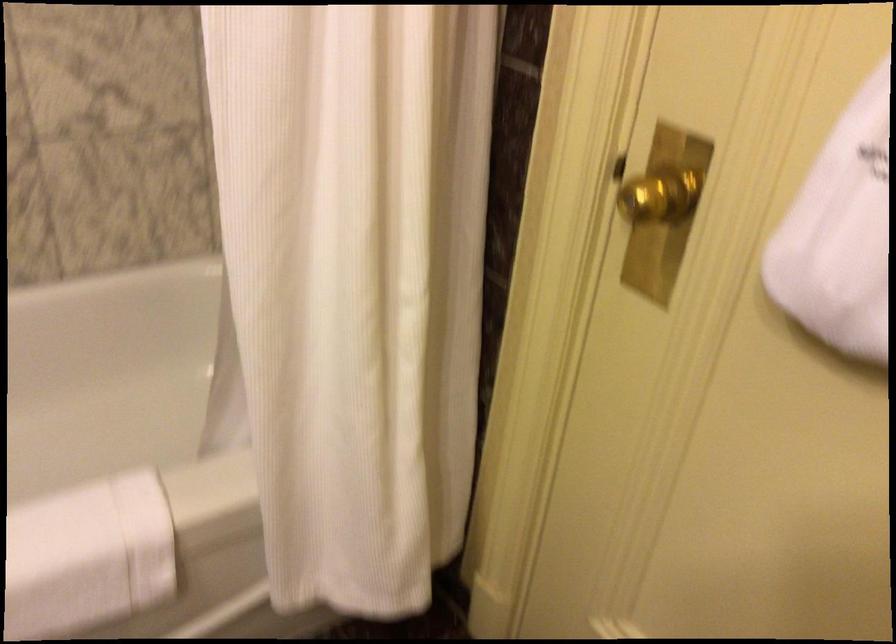
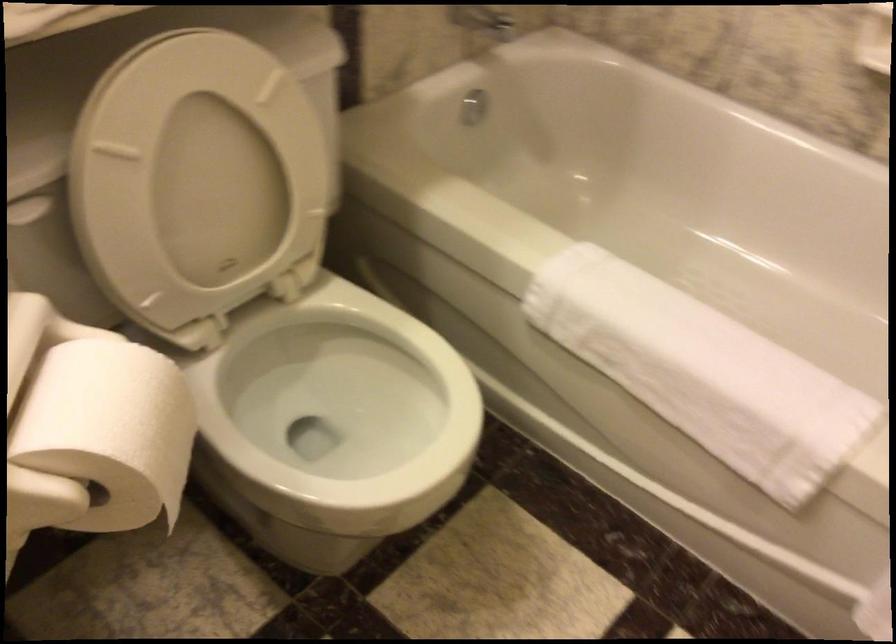
First-person continuous shooting, in which direction is the camera rotating?

The camera's rotation is toward left-down.